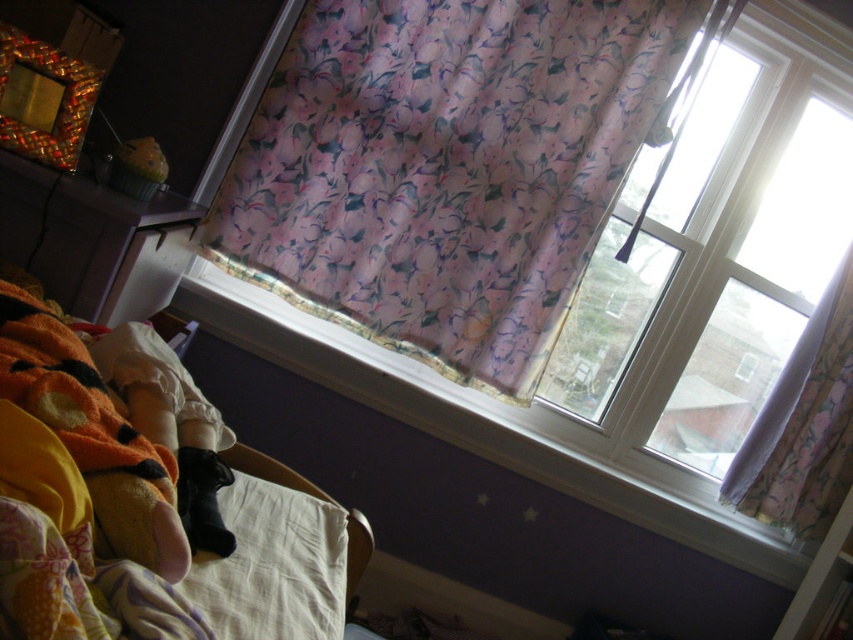
Question: Which point appears closest to the camera in this image?

Choices:
 (A) (405, 132)
 (B) (845, 442)
 (C) (706, 541)

Answer: (A)

Question: Is fluffy yellow fabric at lower left bigger than white cotton pillow at lower left?

Choices:
 (A) no
 (B) yes

Answer: (B)

Question: Is fluffy yellow fabric at lower left positioned at the back of white cotton pillow at lower left?

Choices:
 (A) yes
 (B) no

Answer: (B)

Question: Which point appears closest to the camera in this image?

Choices:
 (A) (56, 492)
 (B) (683, 54)

Answer: (A)

Question: Is white cotton pillow at lower left closer to camera compared to pink floral fabric curtain at upper right?

Choices:
 (A) yes
 (B) no

Answer: (A)

Question: Which object is positioned farthest from the pink floral fabric at upper center?

Choices:
 (A) pink floral fabric curtain at upper right
 (B) floral fabric curtain at upper center

Answer: (B)